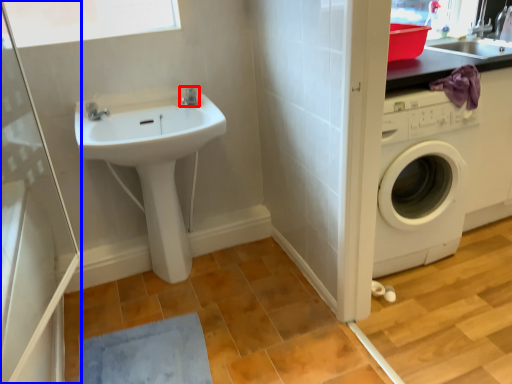
Question: Which object appears closest to the camera in this image, tap (highlighted by a red box) or screen door (highlighted by a blue box)?

Choices:
 (A) tap
 (B) screen door

Answer: (B)